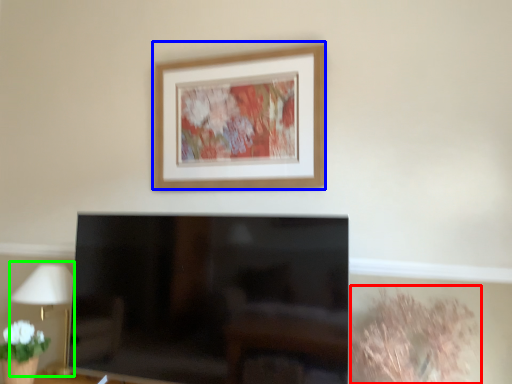
Question: Based on their relative distances, which object is nearer to plant (highlighted by a red box)? Choose from picture frame (highlighted by a blue box) and table lamp (highlighted by a green box).

Choices:
 (A) picture frame
 (B) table lamp

Answer: (A)